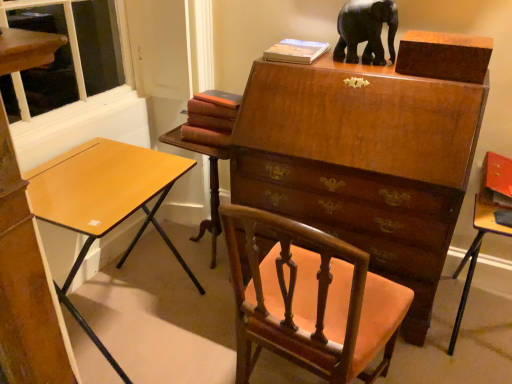
What do you see at coordinates (210, 183) in the screenshot?
I see `mahogany wood table at center, which is the first table in left-to-right order` at bounding box center [210, 183].

In order to face matte orange table at right, which is the 1th table from right to left, should I rotate leftwards or rightwards?

To face it directly, rotate right by 29.699 degrees.

Where is `mahogany wood chair at center`? Image resolution: width=512 pixels, height=384 pixels. mahogany wood chair at center is located at coordinates (310, 300).

What do you see at coordinates (310, 300) in the screenshot? This screenshot has width=512, height=384. I see `mahogany wood chair at center` at bounding box center [310, 300].

Locate an element on the screen. The height and width of the screenshot is (384, 512). hardcover book at upper center, placed as the 1th book when sorted from right to left is located at coordinates (295, 51).

Measure the distance between black glossy elephant at upper center and camera.

The distance of black glossy elephant at upper center from camera is 5.56 feet.

You are a GUI agent. You are given a task and a screenshot of the screen. Output one action in this format:
    pyautogui.click(x=<x>, y=<y>)
    Task: Click on the mahogany wood table at center, which is the first table in left-to-right order
    The width and height of the screenshot is (512, 384).
    Given the screenshot: What is the action you would take?
    pyautogui.click(x=210, y=183)

From the image's perspective, which is above, hardcover book at upper center, the 2th book ordered from the bottom, or matte orange table at right, which ranks as the second table in left-to-right order?

From the image's view, hardcover book at upper center, the 2th book ordered from the bottom, is above.

Considering the sizes of hardcover book at upper center, placed as the 1th book when sorted from right to left, and matte orange table at right, which ranks as the second table in left-to-right order, in the image, is hardcover book at upper center, placed as the 1th book when sorted from right to left, bigger or smaller than matte orange table at right, which ranks as the second table in left-to-right order,?

Clearly, hardcover book at upper center, placed as the 1th book when sorted from right to left, is smaller in size than matte orange table at right, which ranks as the second table in left-to-right order.

The image size is (512, 384). I want to click on book that is the 1st object located behind the matte orange table at right, which ranks as the second table in left-to-right order, so click(295, 51).

Considering the relative sizes of mahogany wood table at center, which appears as the 2th table when viewed from the right, and light brown wood desk at left in the image provided, is mahogany wood table at center, which appears as the 2th table when viewed from the right, bigger than light brown wood desk at left?

No.

Looking at this image, does mahogany wood table at center, which appears as the 2th table when viewed from the right, have a lesser height compared to light brown wood desk at left?

Yes.

Locate an element on the screen. The width and height of the screenshot is (512, 384). desk located in front of the mahogany wood table at center, which appears as the 2th table when viewed from the right is located at coordinates (104, 201).

Is mahogany wood table at center, which appears as the 2th table when viewed from the right, inside the boundaries of light brown wood desk at left, or outside?

mahogany wood table at center, which appears as the 2th table when viewed from the right, is not enclosed by light brown wood desk at left.

Does matte orange table at right, which is the 1th table from right to left, have a lesser width compared to light brown wood desk at left?

Incorrect, the width of matte orange table at right, which is the 1th table from right to left, is not less than that of light brown wood desk at left.

Could you tell me if matte orange table at right, which is the 1th table from right to left, is facing light brown wood desk at left?

No, matte orange table at right, which is the 1th table from right to left, does not turn towards light brown wood desk at left.

Which is more to the right, matte orange table at right, which ranks as the second table in left-to-right order, or light brown wood desk at left?

Positioned to the right is matte orange table at right, which ranks as the second table in left-to-right order.

From the image's perspective, does matte orange table at right, which ranks as the second table in left-to-right order, appear lower than light brown wood desk at left?

Yes.

Is mahogany wood table at center, which appears as the 2th table when viewed from the right, shorter than mahogany wood chair at center?

Correct, mahogany wood table at center, which appears as the 2th table when viewed from the right, is not as tall as mahogany wood chair at center.

From the picture: Is mahogany wood table at center, which appears as the 2th table when viewed from the right, looking in the opposite direction of mahogany wood chair at center?

No.

Can you tell me how much mahogany wood table at center, which is the first table in left-to-right order, and mahogany wood chair at center differ in facing direction?

They differ by 174 degrees in their facing directions.

Is mahogany wood table at center, which is the first table in left-to-right order, inside or outside of mahogany wood chair at center?

mahogany wood table at center, which is the first table in left-to-right order, is not inside mahogany wood chair at center, it's outside.

Which object is positioned more to the right, black glossy elephant at upper center or matte orange table at right, which is the 1th table from right to left?

matte orange table at right, which is the 1th table from right to left.

From the image's perspective, relative to matte orange table at right, which ranks as the second table in left-to-right order, is black glossy elephant at upper center above or below?

Based on their image positions, black glossy elephant at upper center is located above matte orange table at right, which ranks as the second table in left-to-right order.

Based on the photo, what's the angular difference between black glossy elephant at upper center and matte orange table at right, which ranks as the second table in left-to-right order,'s facing directions?

There is a 0.739-degree angle between the facing directions of black glossy elephant at upper center and matte orange table at right, which ranks as the second table in left-to-right order.

Which is farther from the camera, (362, 19) or (467, 289)?

Positioned behind is point (467, 289).

Is mahogany wood chair at center oriented away from matte orange table at right, which ranks as the second table in left-to-right order?

No, mahogany wood chair at center is not facing the opposite direction of matte orange table at right, which ranks as the second table in left-to-right order.

Between mahogany wood chair at center and matte orange table at right, which is the 1th table from right to left, which one has more height?

With more height is mahogany wood chair at center.

Can you tell me how much mahogany wood chair at center and matte orange table at right, which ranks as the second table in left-to-right order, differ in facing direction?

The angular difference between mahogany wood chair at center and matte orange table at right, which ranks as the second table in left-to-right order, is 172 degrees.

Looking at the image, does mahogany wood chair at center seem bigger or smaller compared to matte orange table at right, which ranks as the second table in left-to-right order?

Considering their sizes, mahogany wood chair at center takes up more space than matte orange table at right, which ranks as the second table in left-to-right order.

Considering the relative positions of maroon leather book at center, marked as the second book in a right-to-left arrangement, and mahogany wood table at center, which appears as the 2th table when viewed from the right, in the image provided, is maroon leather book at center, marked as the second book in a right-to-left arrangement, in front of mahogany wood table at center, which appears as the 2th table when viewed from the right,?

Yes, maroon leather book at center, marked as the second book in a right-to-left arrangement, is in front of mahogany wood table at center, which appears as the 2th table when viewed from the right.

Measure the distance from maroon leather book at center, which is the 1th book from bottom to top, to mahogany wood table at center, which is the first table in left-to-right order.

maroon leather book at center, which is the 1th book from bottom to top, and mahogany wood table at center, which is the first table in left-to-right order, are 19.65 centimeters apart from each other.

Considering the sizes of objects maroon leather book at center, marked as the second book in a right-to-left arrangement, and mahogany wood table at center, which appears as the 2th table when viewed from the right, in the image provided, who is taller, maroon leather book at center, marked as the second book in a right-to-left arrangement, or mahogany wood table at center, which appears as the 2th table when viewed from the right,?

Standing taller between the two is mahogany wood table at center, which appears as the 2th table when viewed from the right.

Is point (183, 126) closer to camera compared to point (214, 215)?

Yes.

The image size is (512, 384). I want to click on the 2nd table positioned below the hardcover book at upper center, acting as the 1th book starting from the top (from the image's perspective), so click(x=485, y=222).

This screenshot has height=384, width=512. Identify the location of table that appears above the light brown wood desk at left (from the image's perspective). (210, 183).

Consider the image. Looking at the image, which one is located closer to mahogany wood chair at center, mahogany wood table at center, which is the first table in left-to-right order, or maroon leather book at center, marked as the second book in a right-to-left arrangement?

maroon leather book at center, marked as the second book in a right-to-left arrangement.

When comparing their distances from maroon leather book at center, which is the 1th book from bottom to top, does matte orange table at right, which ranks as the second table in left-to-right order, or mahogany wood table at center, which appears as the 2th table when viewed from the right, seem closer?

The object closer to maroon leather book at center, which is the 1th book from bottom to top, is mahogany wood table at center, which appears as the 2th table when viewed from the right.

Looking at the image, which one is located closer to matte orange table at right, which ranks as the second table in left-to-right order, hardcover book at upper center, acting as the 1th book starting from the top, or light brown wood desk at left?

hardcover book at upper center, acting as the 1th book starting from the top, lies closer to matte orange table at right, which ranks as the second table in left-to-right order, than the other object.

Looking at the image, which one is located further to matte orange table at right, which is the 1th table from right to left, maroon leather book at center, which is the 1th book from bottom to top, or mahogany wood table at center, which is the first table in left-to-right order?

mahogany wood table at center, which is the first table in left-to-right order, is positioned further to the anchor matte orange table at right, which is the 1th table from right to left.

Based on their spatial positions, is hardcover book at upper center, placed as the 1th book when sorted from right to left, or mahogany wood chair at center further from black glossy elephant at upper center?

Among the two, mahogany wood chair at center is located further to black glossy elephant at upper center.

Looking at the image, which one is located further to light brown wood desk at left, hardcover book at upper center, the 2th book ordered from the bottom, or mahogany wood chair at center?

Among the two, hardcover book at upper center, the 2th book ordered from the bottom, is located further to light brown wood desk at left.

Estimate the real-world distances between objects in this image. Which object is closer to light brown wood desk at left, mahogany wood table at center, which appears as the 2th table when viewed from the right, or matte orange table at right, which ranks as the second table in left-to-right order?

Among the two, mahogany wood table at center, which appears as the 2th table when viewed from the right, is located nearer to light brown wood desk at left.

When comparing their distances from matte orange table at right, which is the 1th table from right to left, does mahogany wood table at center, which appears as the 2th table when viewed from the right, or hardcover book at upper center, acting as the 1th book starting from the top, seem further?

mahogany wood table at center, which appears as the 2th table when viewed from the right, is further to matte orange table at right, which is the 1th table from right to left.

Locate an element on the screen. Image resolution: width=512 pixels, height=384 pixels. book between maroon leather book at center, which ranks as the 1th book in left-to-right order, and matte orange table at right, which ranks as the second table in left-to-right order is located at coordinates (295, 51).

Image resolution: width=512 pixels, height=384 pixels. Find the location of `elephant located between light brown wood desk at left and matte orange table at right, which ranks as the second table in left-to-right order, in the left-right direction`. elephant located between light brown wood desk at left and matte orange table at right, which ranks as the second table in left-to-right order, in the left-right direction is located at coordinates (x=366, y=30).

The width and height of the screenshot is (512, 384). What are the coordinates of `chair situated between maroon leather book at center, which ranks as the 1th book in left-to-right order, and matte orange table at right, which is the 1th table from right to left, from left to right` in the screenshot? It's located at (310, 300).

Locate an element on the screen. Image resolution: width=512 pixels, height=384 pixels. desk between mahogany wood chair at center and maroon leather book at center, marked as the second book in a right-to-left arrangement, along the z-axis is located at coordinates (104, 201).